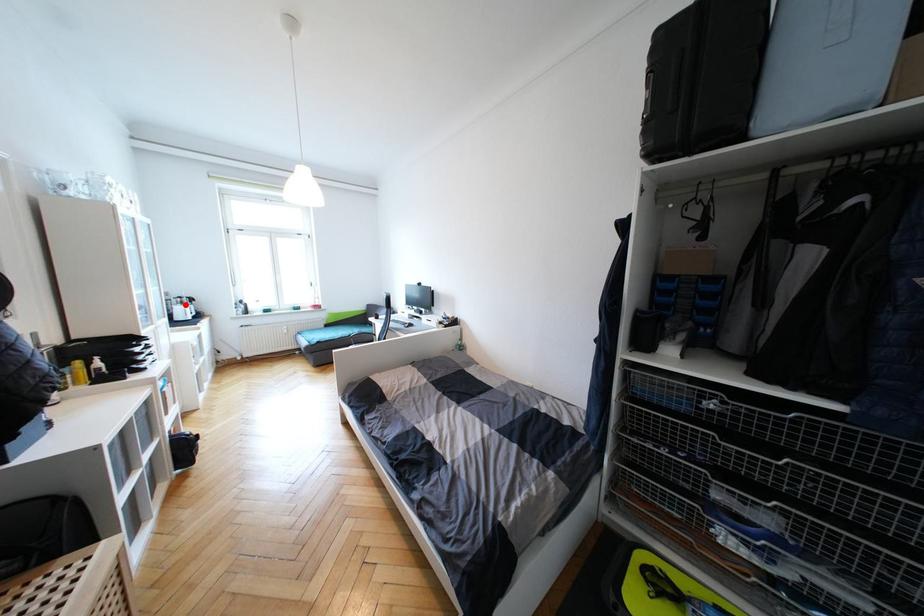
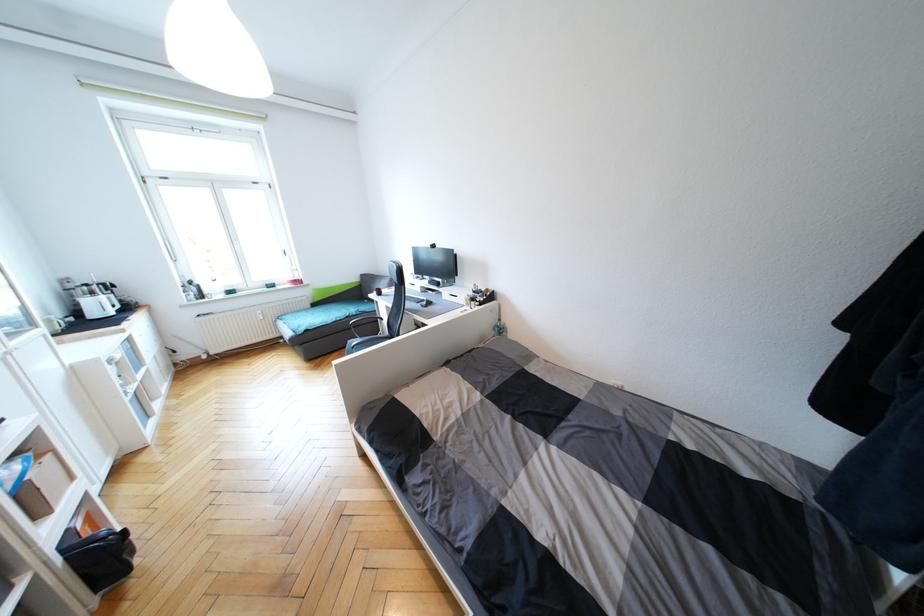
Question: I am providing you with two images of the same scene from different viewpoints. A red point is marked on the first image. At the location where the point appears in image 1, is it still visible in image 2?

Choices:
 (A) Yes
 (B) No

Answer: (A)